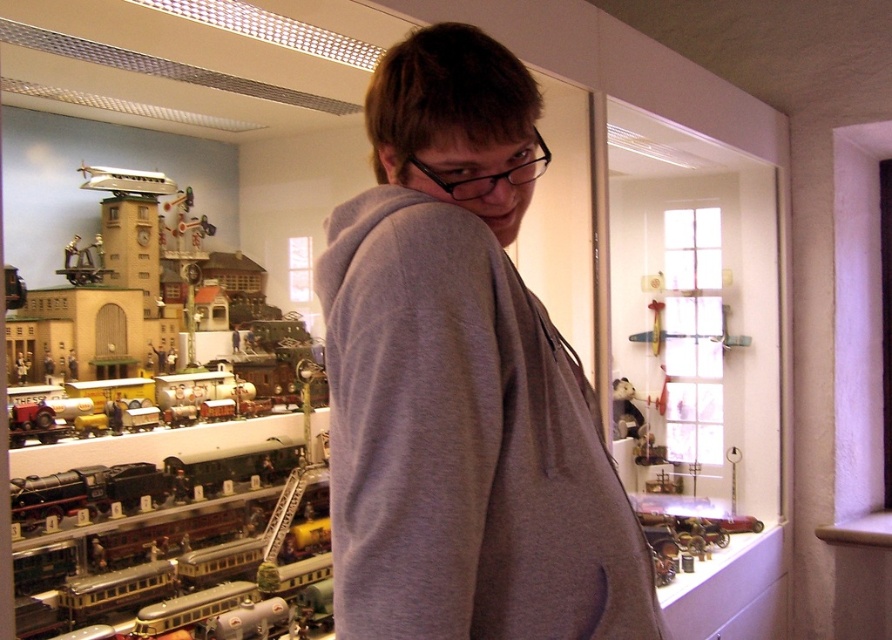
Question: Considering the relative positions of gray cotton hoodie at center and matte green train at left in the image provided, where is gray cotton hoodie at center located with respect to matte green train at left?

Choices:
 (A) left
 (B) right

Answer: (B)

Question: Can you confirm if gray cotton hoodie at center is smaller than matte green train at left?

Choices:
 (A) no
 (B) yes

Answer: (B)

Question: Which of the following is the farthest from the observer?

Choices:
 (A) (446, 518)
 (B) (51, 445)

Answer: (B)

Question: Which of the following is the closest to the observer?

Choices:
 (A) (410, 548)
 (B) (139, 460)

Answer: (A)

Question: Can you confirm if gray cotton hoodie at center is positioned to the right of matte green train at left?

Choices:
 (A) no
 (B) yes

Answer: (B)